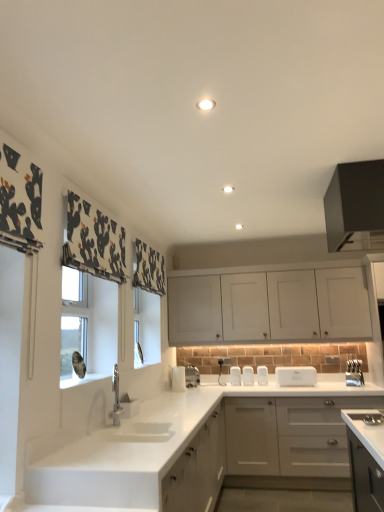
At what (x,y) coordinates should I click in order to perform the action: click on vacant space in front of white plastic toaster at center, which appears as the 2th appliance when viewed from the right. Please return your answer as a coordinate pair (x, y). Image resolution: width=384 pixels, height=512 pixels. Looking at the image, I should click on (310, 387).